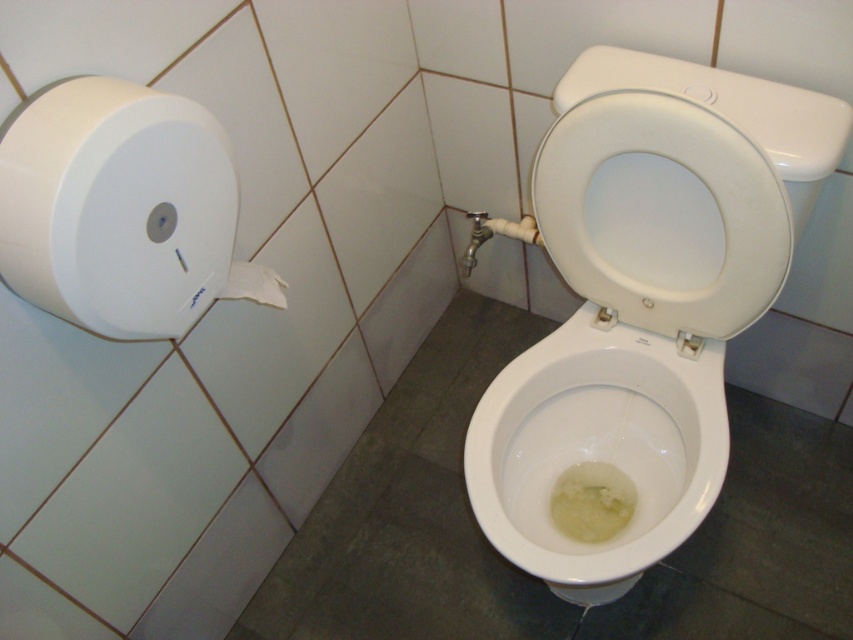
Question: Which point appears closest to the camera in this image?

Choices:
 (A) (532, 484)
 (B) (210, 163)

Answer: (B)

Question: Can you confirm if white plastic toilet paper at left is positioned above white matte toilet paper at upper left?

Choices:
 (A) no
 (B) yes

Answer: (B)

Question: Is white plastic toilet paper at left positioned at the back of white glossy toilet bowl at center?

Choices:
 (A) no
 (B) yes

Answer: (A)

Question: Among these points, which one is nearest to the camera?

Choices:
 (A) (265, 292)
 (B) (54, 147)
 (C) (608, 371)

Answer: (B)

Question: Does white plastic toilet paper at left appear on the right side of white matte toilet paper at upper left?

Choices:
 (A) yes
 (B) no

Answer: (B)

Question: Which point is farther from the camera taking this photo?

Choices:
 (A) (285, 307)
 (B) (45, 305)

Answer: (A)